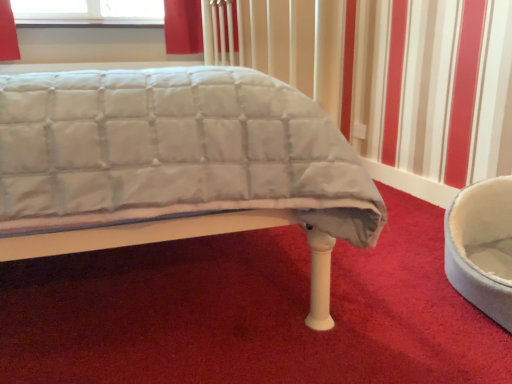
Question: Is white quilted fabric bed at center wider than white plush bean bag at right?

Choices:
 (A) no
 (B) yes

Answer: (B)

Question: Does white quilted fabric bed at center have a lesser width compared to white plush bean bag at right?

Choices:
 (A) yes
 (B) no

Answer: (B)

Question: Is white plush bean bag at right surrounded by white quilted fabric bed at center?

Choices:
 (A) no
 (B) yes

Answer: (A)

Question: Is white quilted fabric bed at center outside of white plush bean bag at right?

Choices:
 (A) yes
 (B) no

Answer: (A)

Question: Does white quilted fabric bed at center have a greater height compared to white plush bean bag at right?

Choices:
 (A) no
 (B) yes

Answer: (B)

Question: Can you confirm if white quilted fabric bed at center is shorter than white plush bean bag at right?

Choices:
 (A) yes
 (B) no

Answer: (B)

Question: Is white plush bean bag at right thinner than white quilted fabric bed at center?

Choices:
 (A) no
 (B) yes

Answer: (B)

Question: Is white plush bean bag at right facing away from white quilted fabric bed at center?

Choices:
 (A) no
 (B) yes

Answer: (A)

Question: Can you confirm if white plush bean bag at right is bigger than white quilted fabric bed at center?

Choices:
 (A) no
 (B) yes

Answer: (A)

Question: Considering the relative positions of white plush bean bag at right and white quilted fabric bed at center in the image provided, is white plush bean bag at right in front of white quilted fabric bed at center?

Choices:
 (A) yes
 (B) no

Answer: (B)

Question: Is white plush bean bag at right outside of white quilted fabric bed at center?

Choices:
 (A) yes
 (B) no

Answer: (A)

Question: From the image's perspective, is white plush bean bag at right below white quilted fabric bed at center?

Choices:
 (A) yes
 (B) no

Answer: (A)

Question: Is white plush bean bag at right in front of or behind white quilted fabric bed at center in the image?

Choices:
 (A) front
 (B) behind

Answer: (B)